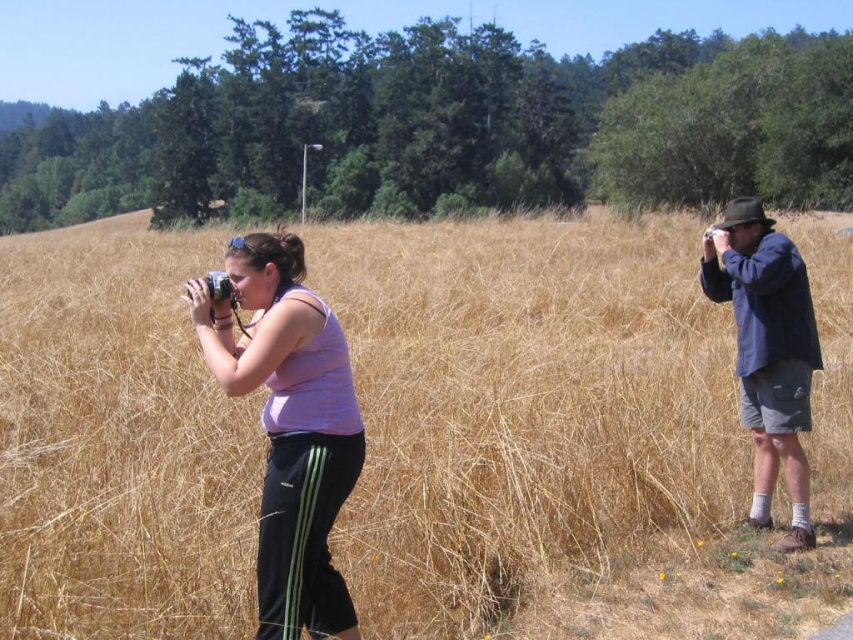
Question: Estimate the real-world distances between objects in this image. Which object is closer to the dry grass at center?

Choices:
 (A) blue denim jacket at right
 (B) pink fabric tank top at center

Answer: (B)

Question: Does dry grass at center come behind blue denim jacket at right?

Choices:
 (A) yes
 (B) no

Answer: (B)

Question: Where is dry grass at center located in relation to blue denim jacket at right in the image?

Choices:
 (A) right
 (B) left

Answer: (B)

Question: Does dry grass at center have a greater width compared to blue denim jacket at right?

Choices:
 (A) yes
 (B) no

Answer: (A)

Question: Which point is closer to the camera?

Choices:
 (A) pink fabric tank top at center
 (B) blue denim jacket at right

Answer: (A)

Question: Estimate the real-world distances between objects in this image. Which object is farther from the dry grass at center?

Choices:
 (A) blue denim jacket at right
 (B) pink fabric tank top at center

Answer: (A)